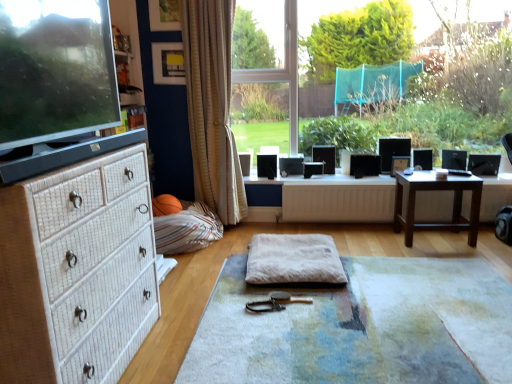
The image size is (512, 384). What are the coordinates of `blank space above white textured radiator at center (from a real-world perspective)` in the screenshot? It's located at (328, 184).